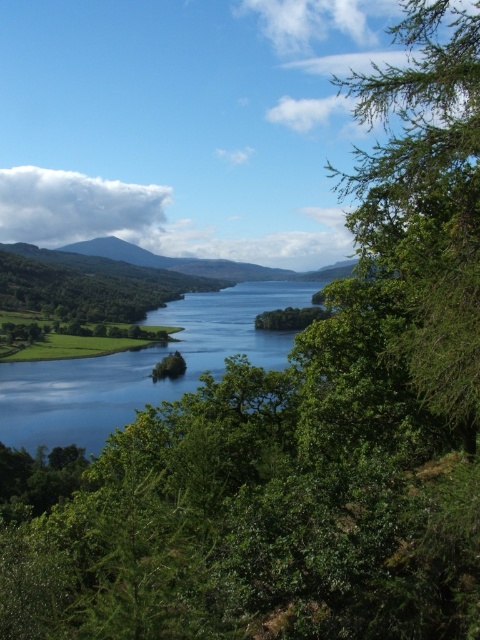
Question: Is green needle-like leaves at right smaller than green grassy water at center?

Choices:
 (A) yes
 (B) no

Answer: (B)

Question: Is green needle-like leaves at right above green grassy water at center?

Choices:
 (A) yes
 (B) no

Answer: (A)

Question: Which object is farther from the camera taking this photo?

Choices:
 (A) green grassy water at center
 (B) green needle-like leaves at right

Answer: (A)

Question: Is green needle-like leaves at right thinner than green grassy water at center?

Choices:
 (A) yes
 (B) no

Answer: (A)